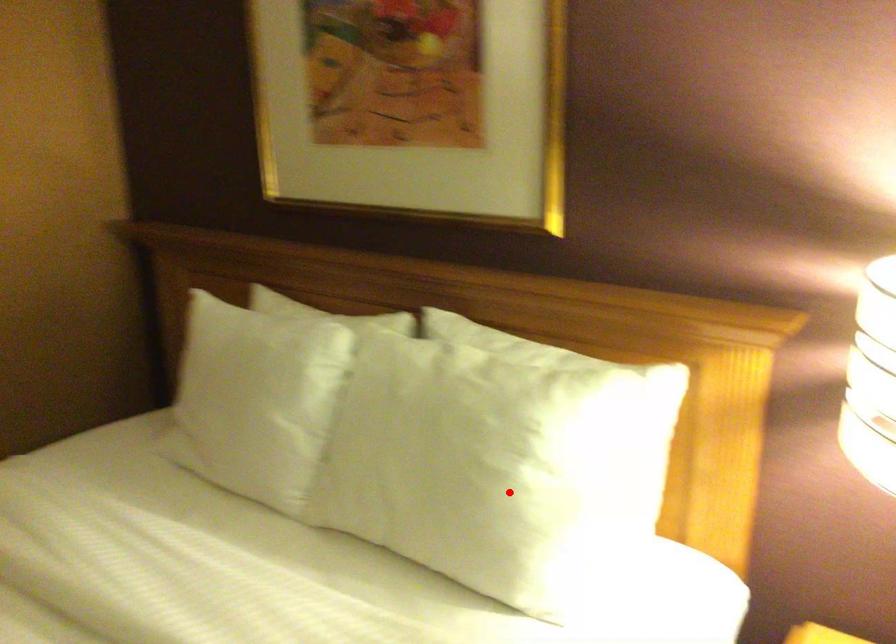
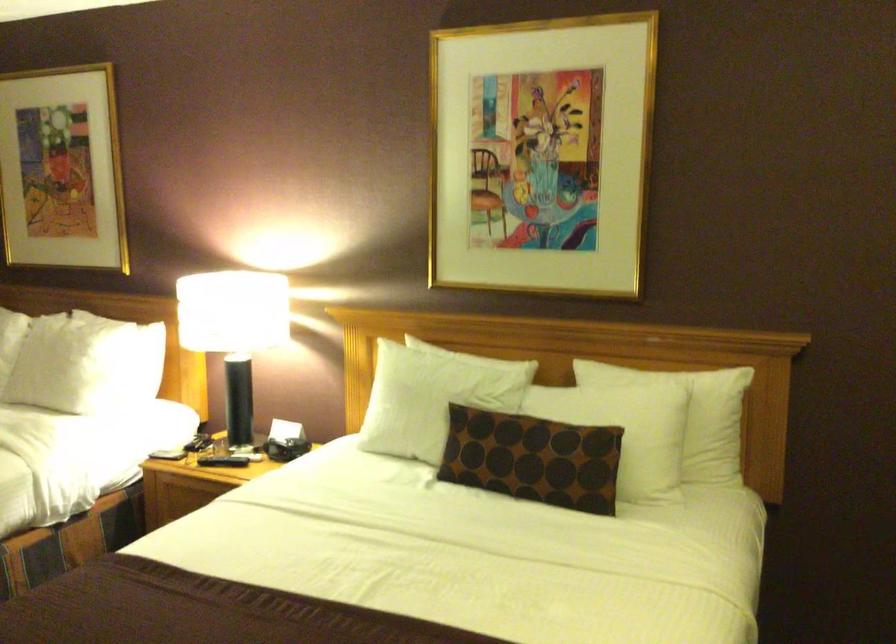
Question: A red point is marked in image1. In image2, is the corresponding 3D point closer to the camera or farther? Reply with the corresponding letter.

Choices:
 (A) The corresponding 3D point is closer.
 (B) The corresponding 3D point is farther.

Answer: (B)